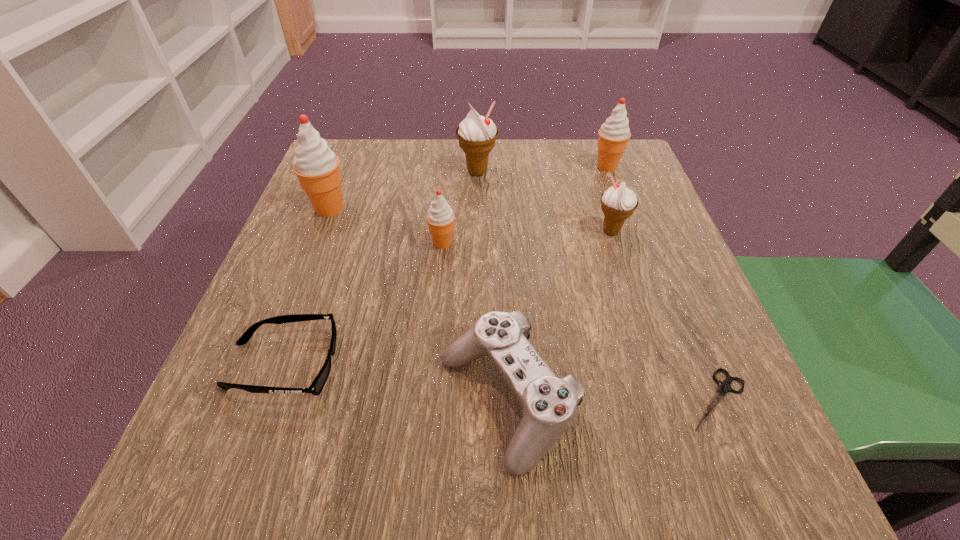
Image resolution: width=960 pixels, height=540 pixels. I want to click on free location at the near edge of the desktop, so click(x=322, y=455).

In the image, there is a desktop. Where is `free space at the right edge`? The height and width of the screenshot is (540, 960). free space at the right edge is located at coordinates (666, 393).

In the image, there is a desktop. Where is `vacant space at the far left corner`? Image resolution: width=960 pixels, height=540 pixels. vacant space at the far left corner is located at coordinates (373, 144).

The height and width of the screenshot is (540, 960). Identify the location of free space at the far right corner. (588, 184).

In the image, there is a desktop. Where is `vacant space at the near right corner`? This screenshot has height=540, width=960. vacant space at the near right corner is located at coordinates (735, 480).

Locate an element on the screen. free space that is in between the black shears and the sunglasses is located at coordinates (500, 382).

This screenshot has height=540, width=960. I want to click on blank region between the biggest red icecream and the farthest red icecream, so click(x=468, y=188).

Where is `vacant area that lies between the nearer white icecream and the shortest object`? vacant area that lies between the nearer white icecream and the shortest object is located at coordinates point(664,315).

In order to click on free space between the sixth tallest object and the bigger white icecream in this screenshot , I will do `click(492, 287)`.

Identify the location of vacant area that lies between the tallest object and the sunglasses. (306, 287).